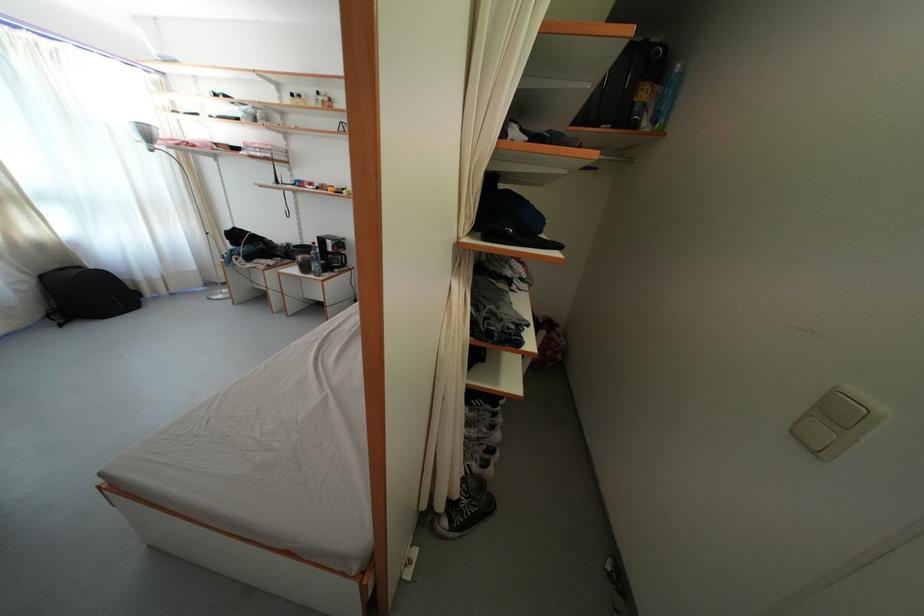
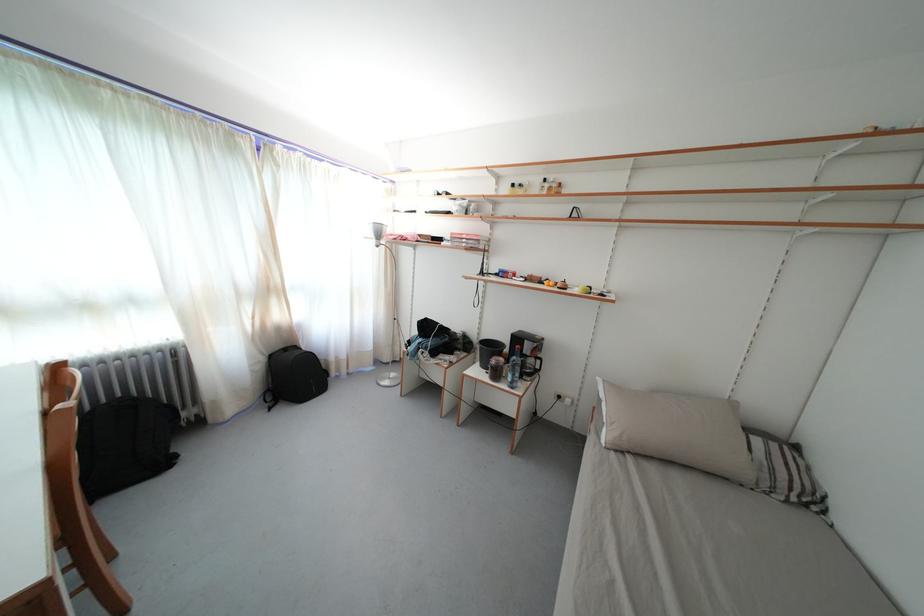
The point at (306, 264) is marked in the first image. Where is the corresponding point in the second image?

(499, 367)